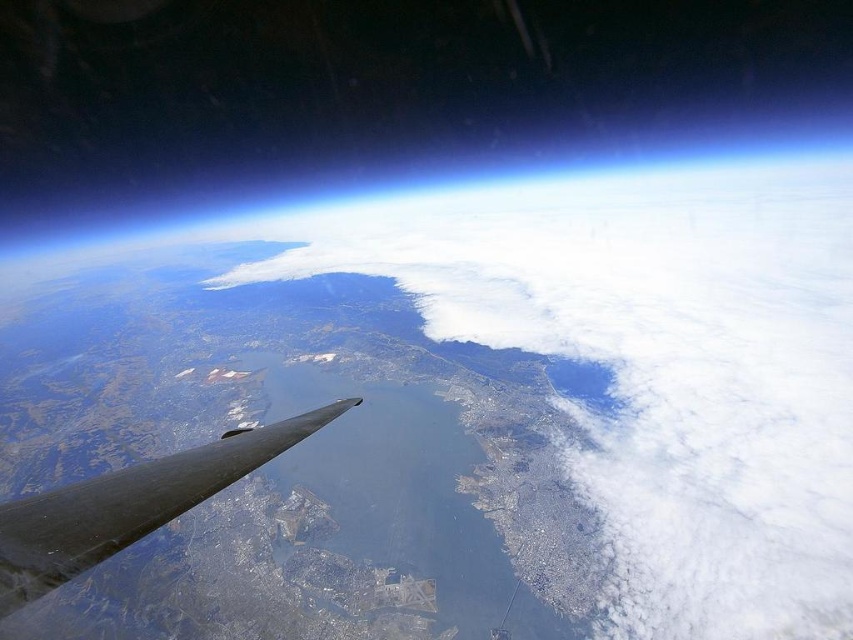
Question: Where is white fluffy cloud at center located in relation to shiny metallic wing at lower left in the image?

Choices:
 (A) below
 (B) above

Answer: (B)

Question: Is white fluffy cloud at center smaller than shiny metallic wing at lower left?

Choices:
 (A) no
 (B) yes

Answer: (A)

Question: Is white fluffy cloud at center positioned before shiny metallic wing at lower left?

Choices:
 (A) yes
 (B) no

Answer: (B)